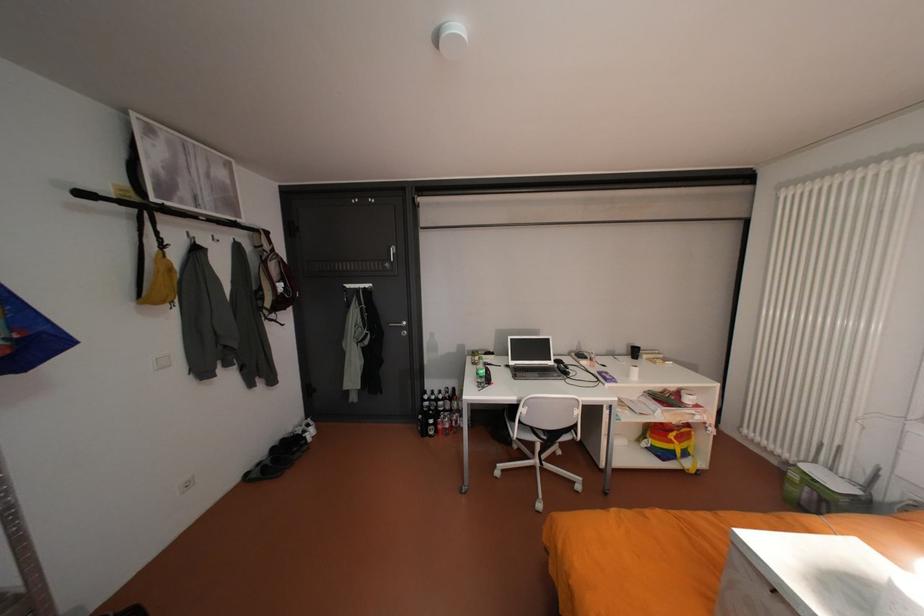
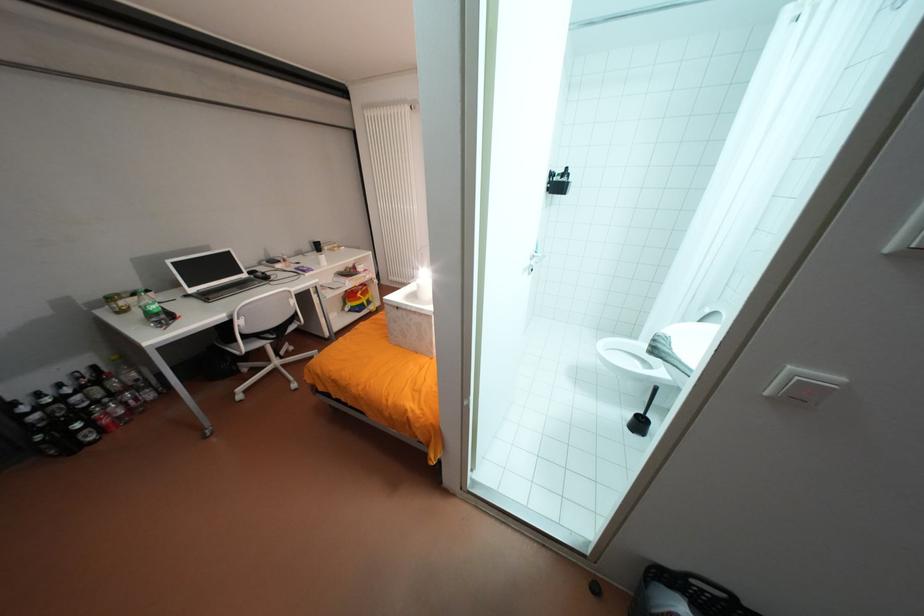
Based on the continuous images, in which direction is the camera rotating?

The rotation direction of the camera is right-down.